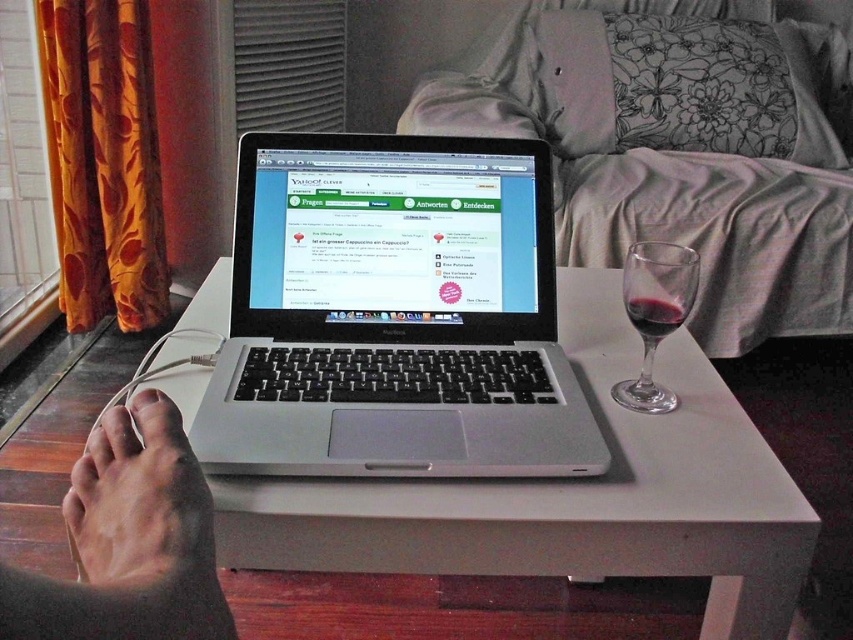
You are a bartender preparing drinks for a customer. You have two glasses on a table, the satin glass wine at right and the translucent glass at lower right. The customer asks you to place a coaster under the glass that is higher up. Which glass should you put the coaster under?

The satin glass wine at right is above the translucent glass at lower right, so you should place the coaster under the satin glass wine at right.

You are a robotic bartender that needs to pour a drink into the satin glass wine at right. According to the image, where exactly should you place the pour spout of the bottle to avoid spills?

The pour spout should be positioned directly above the satin glass wine at right, which is located at coordinates point (677, 150) to ensure accurate pouring and prevent spills.

You are a photographer taking a photo of the scene. You notice two points in the image at coordinates point [674,108] and point [660,308]. Which point is closer to the camera?

Point [674,108] is further to the camera than point [660,308], so point [660,308] is closer to the camera.